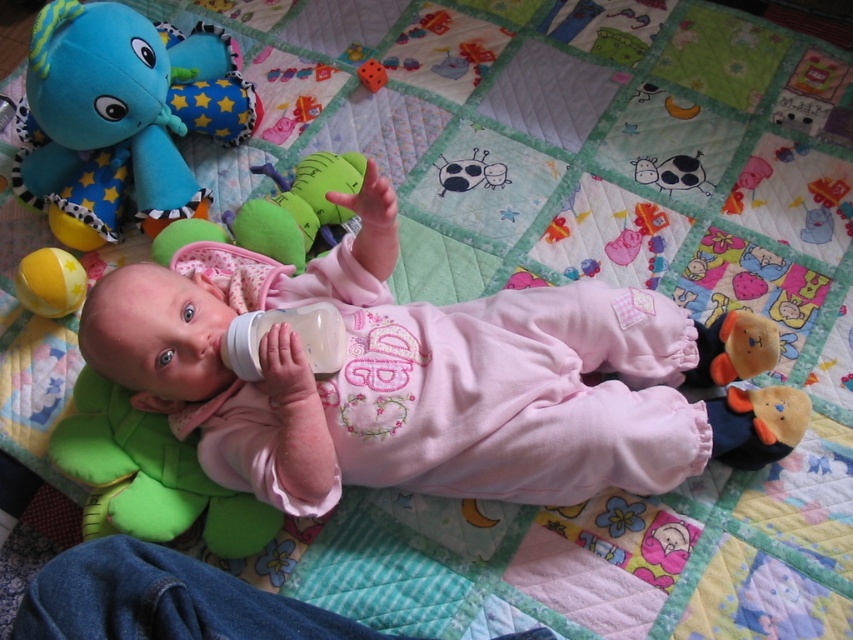
Question: Can you confirm if transparent plastic baby bottle at center is positioned to the left of green plush toy at center?

Choices:
 (A) no
 (B) yes

Answer: (A)

Question: Which of the following is the farthest from the observer?

Choices:
 (A) (152, 227)
 (B) (761, 330)

Answer: (A)

Question: Considering the relative positions of transparent plastic baby bottle at center and green plush cow at upper right in the image provided, where is transparent plastic baby bottle at center located with respect to green plush cow at upper right?

Choices:
 (A) left
 (B) right

Answer: (A)

Question: Which of the following is the farthest from the observer?

Choices:
 (A) yellow rubber ball at lower left
 (B) soft plush bear at upper right
 (C) transparent plastic baby bottle at center

Answer: (A)

Question: Among these objects, which one is farthest from the camera?

Choices:
 (A) brown plush bear at lower right
 (B) rubber dice at center

Answer: (B)

Question: Does soft plush elephant at upper left have a larger size compared to green plush toy at center?

Choices:
 (A) no
 (B) yes

Answer: (B)